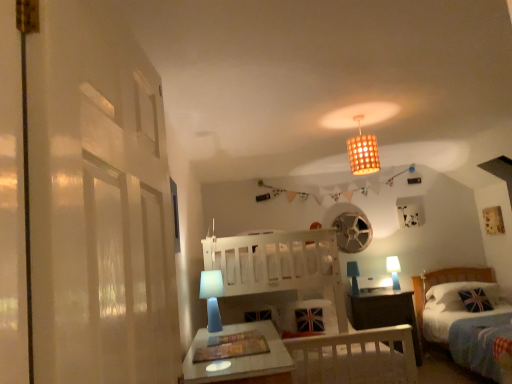
Question: Does bamboo woven lampshade at upper center turn towards blue fabric lampshade at lower center, arranged as the first table lamp when viewed from the front?

Choices:
 (A) yes
 (B) no

Answer: (B)

Question: Does bamboo woven lampshade at upper center have a greater height compared to blue fabric lampshade at lower center, placed as the 3th table lamp when sorted from back to front?

Choices:
 (A) no
 (B) yes

Answer: (B)

Question: Does bamboo woven lampshade at upper center have a larger size compared to blue fabric lampshade at lower center, placed as the 3th table lamp when sorted from back to front?

Choices:
 (A) yes
 (B) no

Answer: (A)

Question: Is blue fabric lampshade at lower center, the third table lamp positioned from the right, at the back of bamboo woven lampshade at upper center?

Choices:
 (A) no
 (B) yes

Answer: (A)

Question: Can we say bamboo woven lampshade at upper center lies outside blue fabric lampshade at lower center, arranged as the first table lamp when viewed from the front?

Choices:
 (A) no
 (B) yes

Answer: (B)

Question: Considering the positions of blue fabric lampshade at lower center, which is counted as the first table lamp, starting from the left, and blue matte table lamp at right, the 3th table lamp from the front, in the image, is blue fabric lampshade at lower center, which is counted as the first table lamp, starting from the left, taller or shorter than blue matte table lamp at right, the 3th table lamp from the front,?

Choices:
 (A) tall
 (B) short

Answer: (A)

Question: Does point (202, 281) appear closer or farther from the camera than point (393, 269)?

Choices:
 (A) farther
 (B) closer

Answer: (B)

Question: From a real-world perspective, relative to blue matte table lamp at right, positioned as the 1th table lamp in right-to-left order, is blue fabric lampshade at lower center, which is counted as the first table lamp, starting from the left, vertically above or below?

Choices:
 (A) above
 (B) below

Answer: (A)

Question: Is blue fabric lampshade at lower center, placed as the 3th table lamp when sorted from back to front, situated inside blue matte table lamp at right, placed as the 3th table lamp when sorted from left to right, or outside?

Choices:
 (A) inside
 (B) outside

Answer: (B)

Question: From the image's perspective, relative to union jack fabric pillow at lower right, is white wooden bunk bed at center above or below?

Choices:
 (A) above
 (B) below

Answer: (A)

Question: Considering the positions of white wooden bunk bed at center and union jack fabric pillow at lower right in the image, is white wooden bunk bed at center taller or shorter than union jack fabric pillow at lower right?

Choices:
 (A) short
 (B) tall

Answer: (B)

Question: In terms of width, does white wooden bunk bed at center look wider or thinner when compared to union jack fabric pillow at lower right?

Choices:
 (A) wide
 (B) thin

Answer: (A)

Question: Relative to union jack fabric pillow at lower right, is white wooden bunk bed at center in front or behind?

Choices:
 (A) front
 (B) behind

Answer: (A)

Question: Is blue fabric lampshade at lower center, the third table lamp positioned from the right, in front of or behind white wooden bunk bed at center in the image?

Choices:
 (A) front
 (B) behind

Answer: (A)

Question: Which is correct: blue fabric lampshade at lower center, placed as the 3th table lamp when sorted from back to front, is inside white wooden bunk bed at center, or outside of it?

Choices:
 (A) inside
 (B) outside

Answer: (B)